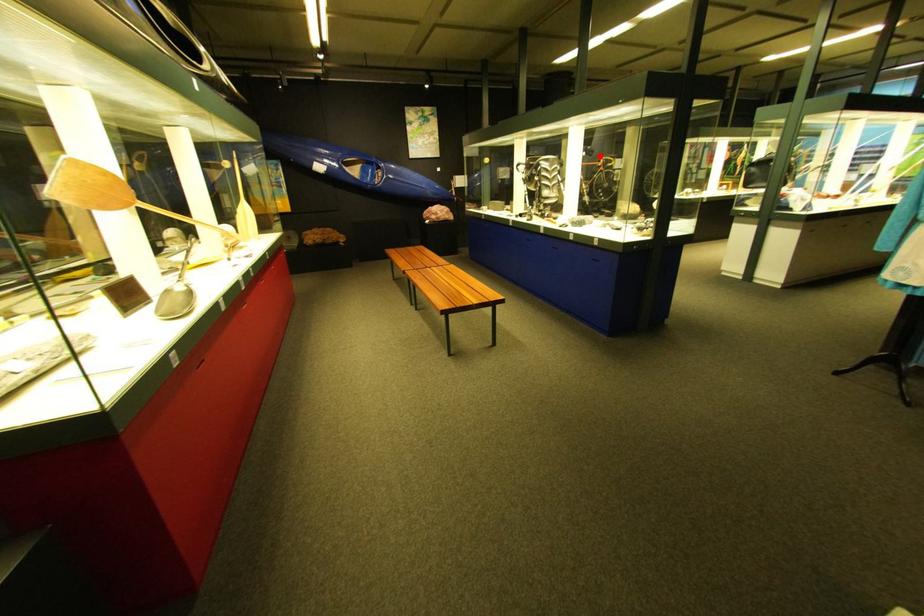
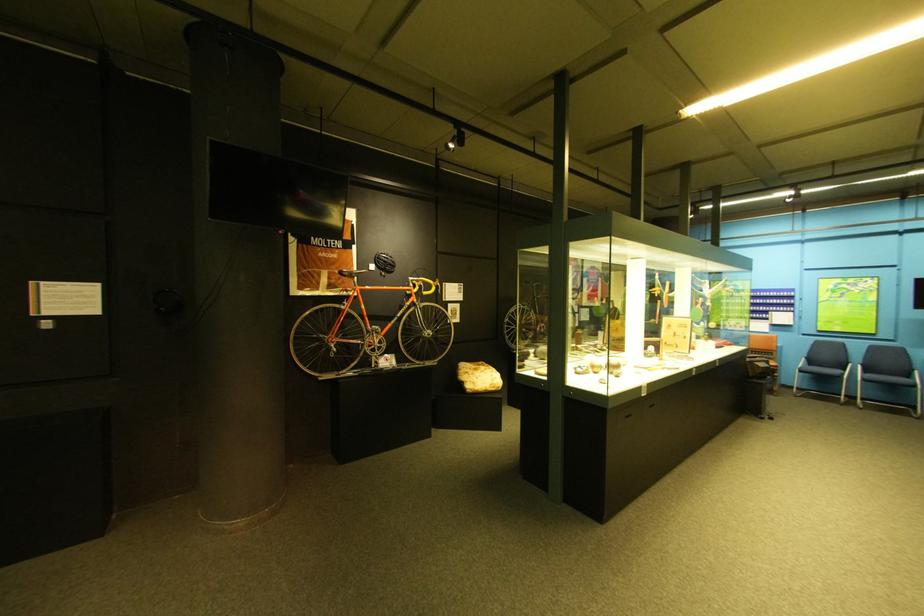
The point at the highlighted location is marked in the first image. Where is the corresponding point in the second image?

(388, 269)